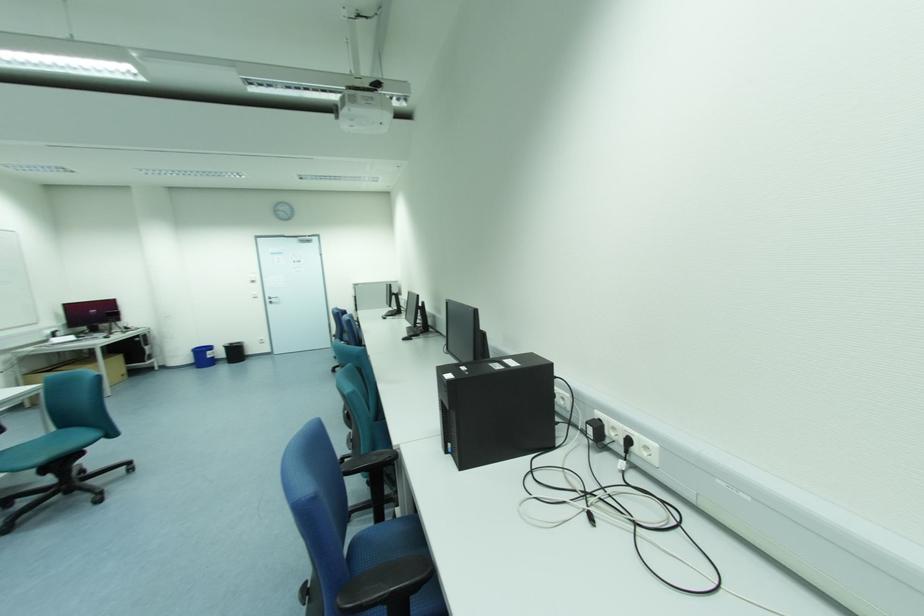
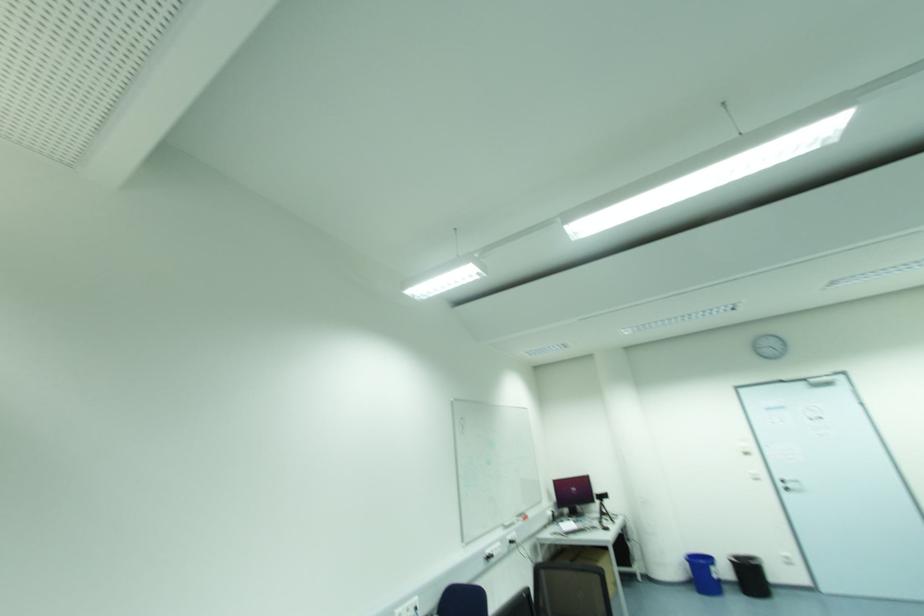
Find the pixel in the second image that matches (x=233, y=344) in the first image.

(736, 559)